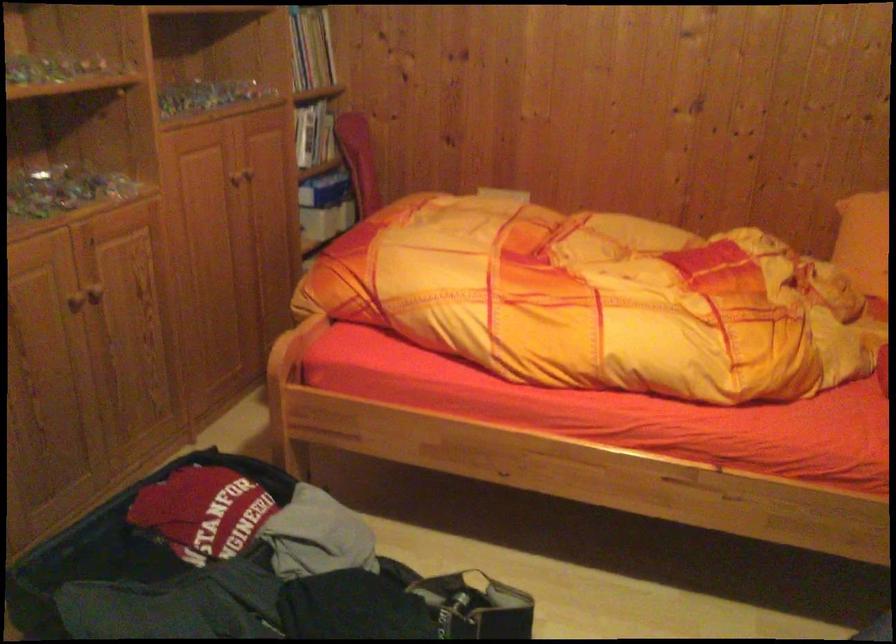
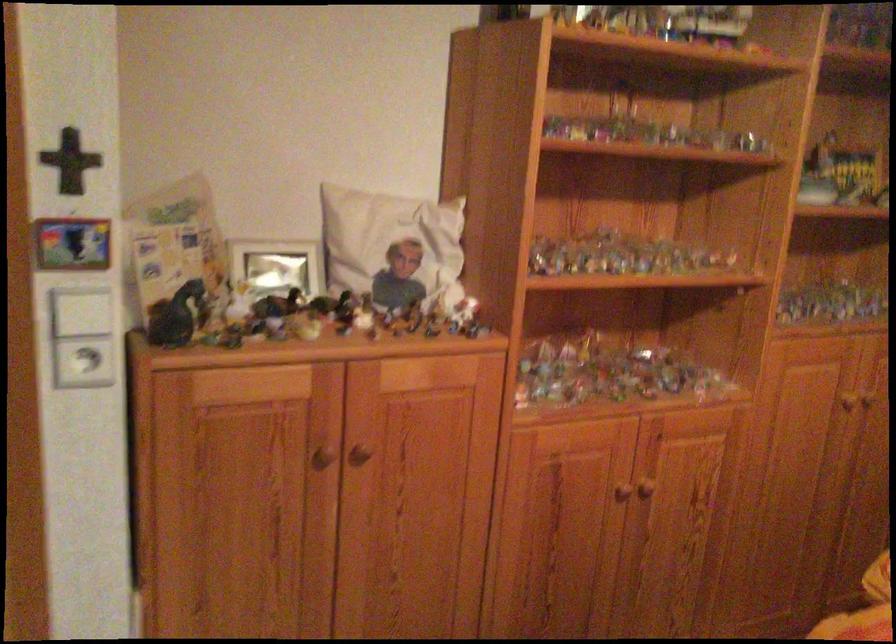
Question: The camera is either moving clockwise (left) or counter-clockwise (right) around the object. The first image is from the beginning of the video and the second image is from the end. Is the camera moving left or right when shooting the video?

Choices:
 (A) Left
 (B) Right

Answer: (B)